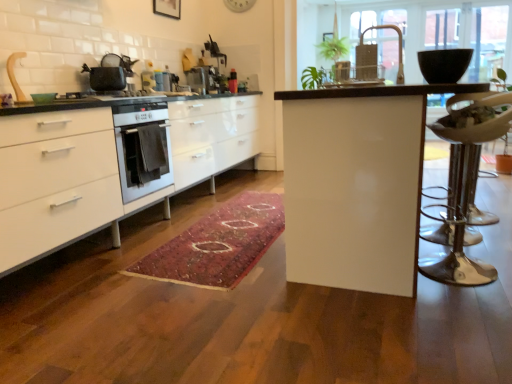
Question: Should I look upward or downward to see rug with intricate patterns at center?

Choices:
 (A) up
 (B) down

Answer: (B)

Question: Does metallic silver swivel chair at right have a greater width compared to wooden picture frame at upper center?

Choices:
 (A) yes
 (B) no

Answer: (A)

Question: Is metallic silver swivel chair at right to the left of wooden picture frame at upper center from the viewer's perspective?

Choices:
 (A) no
 (B) yes

Answer: (A)

Question: Is metallic silver swivel chair at right located outside wooden picture frame at upper center?

Choices:
 (A) yes
 (B) no

Answer: (A)

Question: From a real-world perspective, is metallic silver swivel chair at right below wooden picture frame at upper center?

Choices:
 (A) yes
 (B) no

Answer: (A)

Question: Is wooden picture frame at upper center surrounded by metallic silver swivel chair at right?

Choices:
 (A) no
 (B) yes

Answer: (A)

Question: From a real-world perspective, is metallic silver swivel chair at right on wooden picture frame at upper center?

Choices:
 (A) no
 (B) yes

Answer: (A)

Question: From a real-world perspective, does rug with intricate patterns at center sit lower than white glossy cabinets at left?

Choices:
 (A) no
 (B) yes

Answer: (B)

Question: Could you tell me if rug with intricate patterns at center is turned towards white glossy cabinets at left?

Choices:
 (A) no
 (B) yes

Answer: (A)

Question: Is rug with intricate patterns at center positioned with its back to white glossy cabinets at left?

Choices:
 (A) no
 (B) yes

Answer: (A)

Question: Considering the relative sizes of rug with intricate patterns at center and white glossy cabinets at left in the image provided, is rug with intricate patterns at center bigger than white glossy cabinets at left?

Choices:
 (A) no
 (B) yes

Answer: (A)

Question: Can you confirm if rug with intricate patterns at center is taller than white glossy cabinets at left?

Choices:
 (A) no
 (B) yes

Answer: (A)

Question: Can you confirm if rug with intricate patterns at center is smaller than white glossy cabinets at left?

Choices:
 (A) yes
 (B) no

Answer: (A)

Question: Is matte black pot at upper left far away from metallic gold faucet at upper center?

Choices:
 (A) yes
 (B) no

Answer: (A)